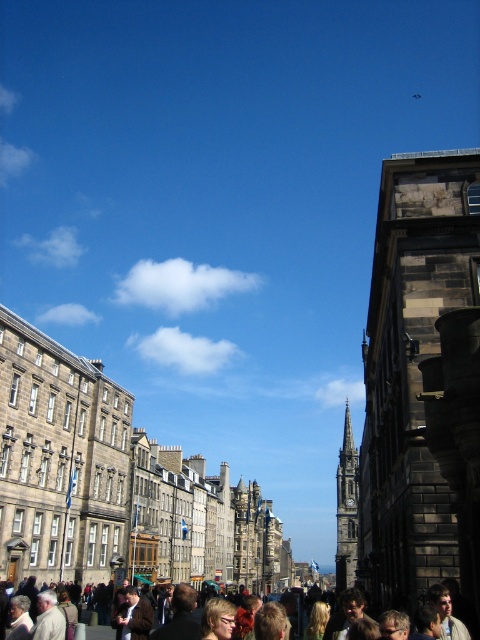
Is dark stone tower at right above brown leather jacket at lower center?

Correct, dark stone tower at right is located above brown leather jacket at lower center.

Does point (393, 214) come in front of point (197, 616)?

Yes, point (393, 214) is in front of point (197, 616).

Locate an element on the screen. The image size is (480, 640). dark stone tower at right is located at coordinates click(416, 378).

Who is shorter, dark stone tower at right or dark gray stone spire at center?

Standing shorter between the two is dark gray stone spire at center.

What do you see at coordinates (416, 378) in the screenshot?
I see `dark stone tower at right` at bounding box center [416, 378].

Which is in front, point (387, 253) or point (339, 577)?

Point (387, 253) is in front.

Identify the location of dark stone tower at right. (416, 378).

Which is above, dark gray stone spire at center or brown leather jacket at lower center?

Positioned higher is brown leather jacket at lower center.

Does dark gray stone spire at center have a greater width compared to brown leather jacket at lower center?

In fact, dark gray stone spire at center might be narrower than brown leather jacket at lower center.

Does point (347, 486) come behind point (471, 611)?

Yes.

You are a GUI agent. You are given a task and a screenshot of the screen. Output one action in this format:
    pyautogui.click(x=<x>, y=<y>)
    Task: Click on the dark gray stone spire at center
    This screenshot has width=480, height=640.
    Given the screenshot: What is the action you would take?
    pyautogui.click(x=347, y=508)